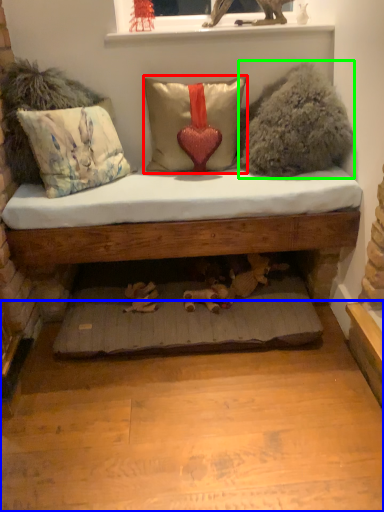
Question: Which object is the closest to the pillow (highlighted by a red box)? Choose among these: platform (highlighted by a blue box) or animal (highlighted by a green box).

Choices:
 (A) platform
 (B) animal

Answer: (B)